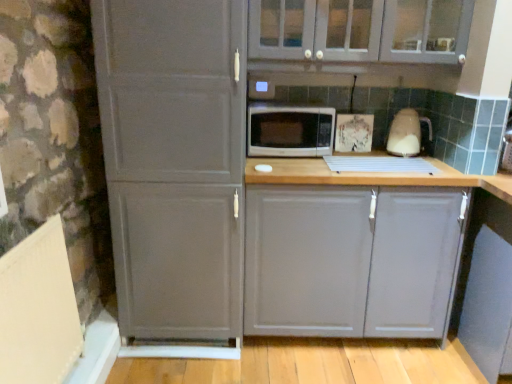
Identify the location of free space in front of white glossy microwave at center. Image resolution: width=512 pixels, height=384 pixels. (306, 165).